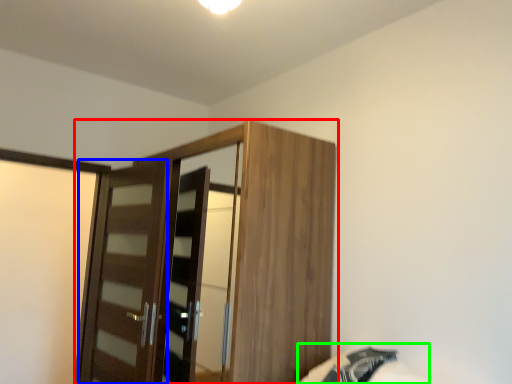
Question: Which object is the closest to the cupboard (highlighted by a red box)? Choose among these: door (highlighted by a blue box) or bed (highlighted by a green box).

Choices:
 (A) door
 (B) bed

Answer: (A)